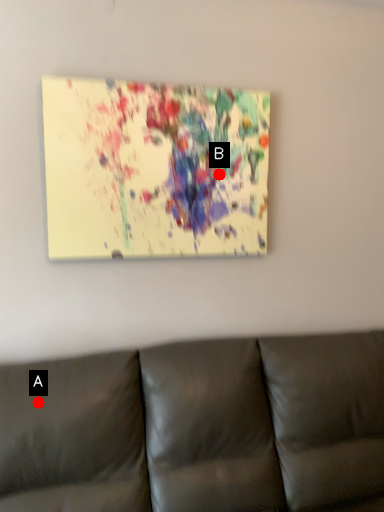
Question: Two points are circled on the image, labeled by A and B beside each circle. Which point is farther to the camera?

Choices:
 (A) A is further
 (B) B is further

Answer: (B)